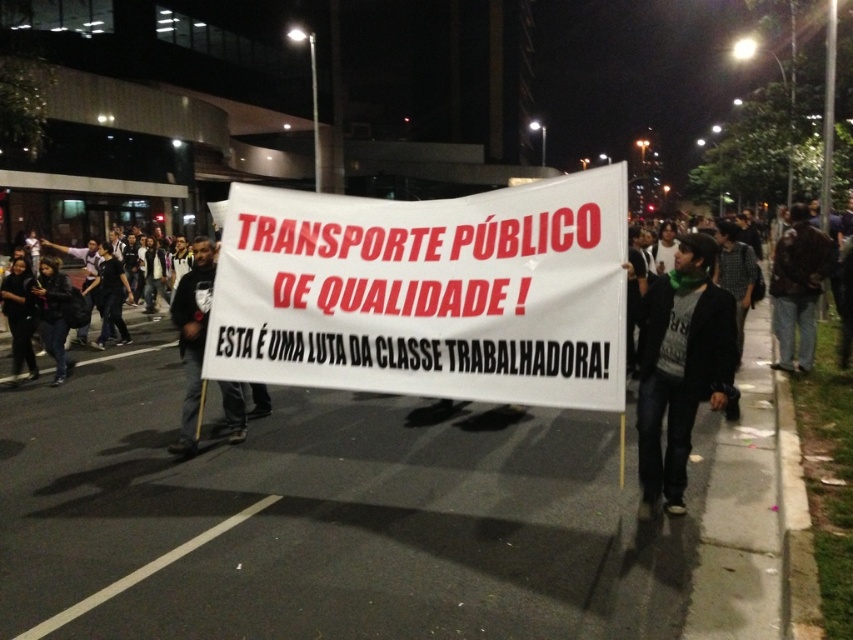
Is white paper banner at center taller than dark brown leather jacket at right?

In fact, white paper banner at center may be shorter than dark brown leather jacket at right.

Does point (621, 278) lie in front of point (791, 266)?

Yes, point (621, 278) is in front of point (791, 266).

Does point (287, 248) come closer to viewer compared to point (811, 321)?

Yes, point (287, 248) is closer to viewer.

The width and height of the screenshot is (853, 640). Identify the location of white paper banner at center. (428, 292).

Is green knitted scarf at center above black leather jacket at left?

Actually, green knitted scarf at center is below black leather jacket at left.

Which is in front, point (677, 349) or point (44, 291)?

Positioned in front is point (677, 349).

Between point (659, 444) and point (54, 298), which one is positioned in front?

Positioned in front is point (659, 444).

Identify the location of green knitted scarf at center. (680, 368).

Measure the distance between black leather jacket at left and dark brown leather jacket at right.

A distance of 9.42 meters exists between black leather jacket at left and dark brown leather jacket at right.

This screenshot has height=640, width=853. Describe the element at coordinates (74, 305) in the screenshot. I see `black leather jacket at left` at that location.

This screenshot has height=640, width=853. What are the coordinates of `black leather jacket at left` in the screenshot? It's located at (74, 305).